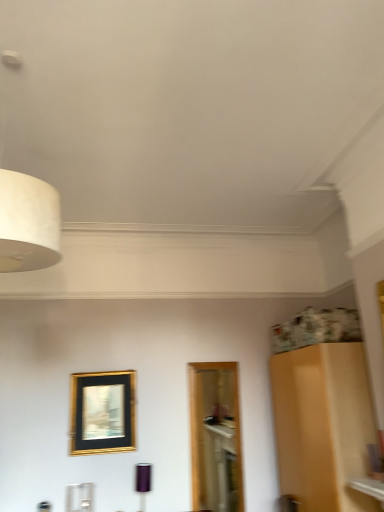
Question: Is white matte lampshade at upper left, which appears as the first lamp when viewed from the left, located within matte black lampshade at lower center, which is counted as the second lamp, starting from the front?

Choices:
 (A) no
 (B) yes

Answer: (A)

Question: Can you confirm if matte black lampshade at lower center, which is counted as the 2th lamp, starting from the left, is shorter than white matte lampshade at upper left, the second lamp when ordered from back to front?

Choices:
 (A) yes
 (B) no

Answer: (A)

Question: From a real-world perspective, is matte black lampshade at lower center, which appears as the first lamp when viewed from the back, beneath white matte lampshade at upper left, which is the 1th lamp in top-to-bottom order?

Choices:
 (A) no
 (B) yes

Answer: (B)

Question: Is matte black lampshade at lower center, positioned as the first lamp in bottom-to-top order, in contact with white matte lampshade at upper left, which appears as the first lamp when viewed from the left?

Choices:
 (A) no
 (B) yes

Answer: (A)

Question: Is matte black lampshade at lower center, which ranks as the 2th lamp in top-to-bottom order, outside of white matte lampshade at upper left, placed as the 1th lamp when sorted from front to back?

Choices:
 (A) no
 (B) yes

Answer: (B)

Question: Looking at their shapes, would you say white matte lampshade at upper left, which is the 1th lamp in top-to-bottom order, is wider or thinner than matte black lampshade at lower center, positioned as the first lamp in bottom-to-top order?

Choices:
 (A) wide
 (B) thin

Answer: (A)

Question: From the image's perspective, is white matte lampshade at upper left, the 2th lamp positioned from the right, above or below matte black lampshade at lower center, which appears as the first lamp when viewed from the back?

Choices:
 (A) below
 (B) above

Answer: (B)

Question: Based on their sizes in the image, would you say white matte lampshade at upper left, positioned as the 2th lamp in bottom-to-top order, is bigger or smaller than matte black lampshade at lower center, placed as the first lamp when sorted from right to left?

Choices:
 (A) small
 (B) big

Answer: (B)

Question: Is white matte lampshade at upper left, the second lamp when ordered from back to front, in front of or behind matte black lampshade at lower center, which ranks as the 2th lamp in top-to-bottom order, in the image?

Choices:
 (A) front
 (B) behind

Answer: (A)

Question: In the image, is gold/black/glass picture frame at center on the left side or the right side of white matte lampshade at upper left, which is the 1th lamp in top-to-bottom order?

Choices:
 (A) right
 (B) left

Answer: (A)

Question: From the image's perspective, is gold/black/glass picture frame at center positioned above or below white matte lampshade at upper left, the second lamp when ordered from back to front?

Choices:
 (A) below
 (B) above

Answer: (A)

Question: Does point (79, 415) appear closer or farther from the camera than point (3, 265)?

Choices:
 (A) farther
 (B) closer

Answer: (A)

Question: Looking at the image, does gold/black/glass picture frame at center seem bigger or smaller compared to white matte lampshade at upper left, positioned as the 2th lamp in bottom-to-top order?

Choices:
 (A) big
 (B) small

Answer: (B)

Question: From a real-world perspective, relative to gold/black/glass picture frame at center, is white matte lampshade at upper left, which appears as the first lamp when viewed from the left, vertically above or below?

Choices:
 (A) above
 (B) below

Answer: (A)

Question: Does point click(54, 195) appear closer or farther from the camera than point click(104, 373)?

Choices:
 (A) closer
 (B) farther

Answer: (A)